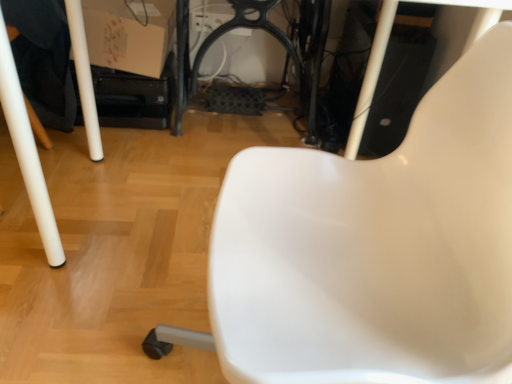
Question: From the image's perspective, is white plastic chair at center above or below matte cardboard box at upper left?

Choices:
 (A) below
 (B) above

Answer: (A)

Question: Do you think white plastic chair at center is within matte cardboard box at upper left, or outside of it?

Choices:
 (A) outside
 (B) inside

Answer: (A)

Question: Does point (199, 337) appear closer or farther from the camera than point (125, 66)?

Choices:
 (A) farther
 (B) closer

Answer: (B)

Question: From the image's perspective, is matte cardboard box at upper left positioned above or below white plastic chair at center?

Choices:
 (A) below
 (B) above

Answer: (B)

Question: Is matte cardboard box at upper left taller or shorter than white plastic chair at center?

Choices:
 (A) tall
 (B) short

Answer: (B)

Question: In the image, is matte cardboard box at upper left positioned in front of or behind white plastic chair at center?

Choices:
 (A) behind
 (B) front

Answer: (A)

Question: From a real-world perspective, is matte cardboard box at upper left positioned above or below white plastic chair at center?

Choices:
 (A) above
 (B) below

Answer: (B)